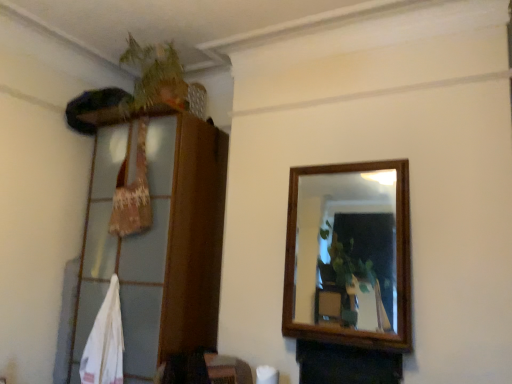
Question: Is wooden dresser at left shorter than green leafy plant at upper left?

Choices:
 (A) no
 (B) yes

Answer: (A)

Question: From the image's perspective, is wooden dresser at left located above green leafy plant at upper left?

Choices:
 (A) no
 (B) yes

Answer: (A)

Question: Can green leafy plant at upper left be found inside wooden dresser at left?

Choices:
 (A) no
 (B) yes

Answer: (A)

Question: Considering the relative positions of wooden dresser at left and green leafy plant at upper left in the image provided, is wooden dresser at left to the right of green leafy plant at upper left from the viewer's perspective?

Choices:
 (A) yes
 (B) no

Answer: (B)

Question: From a real-world perspective, is wooden dresser at left over green leafy plant at upper left?

Choices:
 (A) no
 (B) yes

Answer: (A)

Question: From the image's perspective, is wooden dresser at left under green leafy plant at upper left?

Choices:
 (A) no
 (B) yes

Answer: (B)

Question: From a real-world perspective, is green leafy plant at upper left located higher than wooden dresser at left?

Choices:
 (A) no
 (B) yes

Answer: (B)

Question: Could you tell me if green leafy plant at upper left is facing wooden dresser at left?

Choices:
 (A) no
 (B) yes

Answer: (A)

Question: Is green leafy plant at upper left shorter than wooden dresser at left?

Choices:
 (A) no
 (B) yes

Answer: (B)

Question: Is green leafy plant at upper left not near wooden dresser at left?

Choices:
 (A) no
 (B) yes

Answer: (A)

Question: Is the position of green leafy plant at upper left more distant than that of wooden dresser at left?

Choices:
 (A) yes
 (B) no

Answer: (A)

Question: Is green leafy plant at upper left positioned in front of wooden dresser at left?

Choices:
 (A) yes
 (B) no

Answer: (B)

Question: Is green leafy plant at upper left taller or shorter than wooden dresser at left?

Choices:
 (A) tall
 (B) short

Answer: (B)